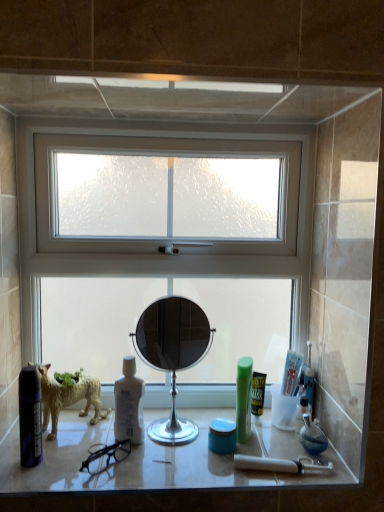
I want to click on free space in front of white glossy mouthwash at center, the 1th mouthwash viewed from the left, so click(x=125, y=468).